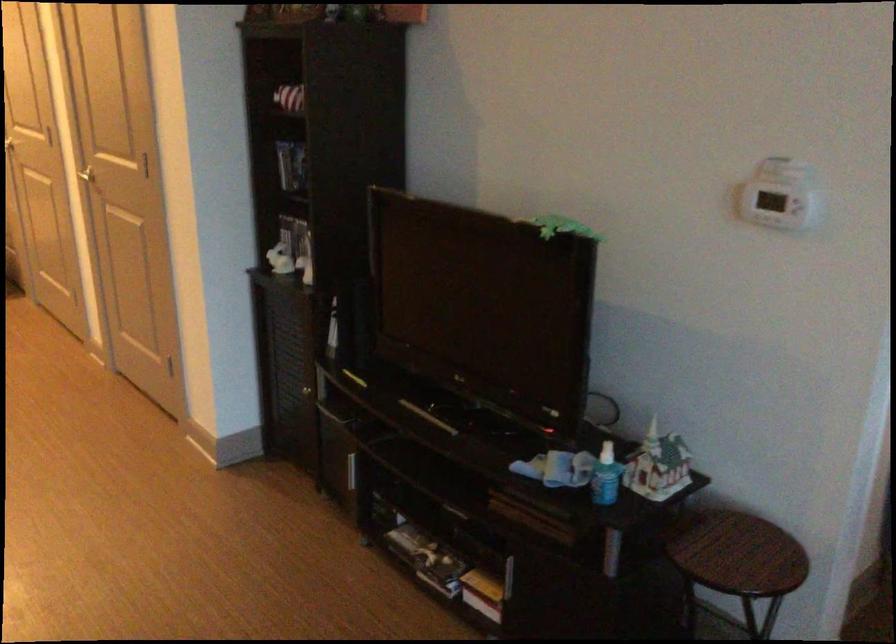
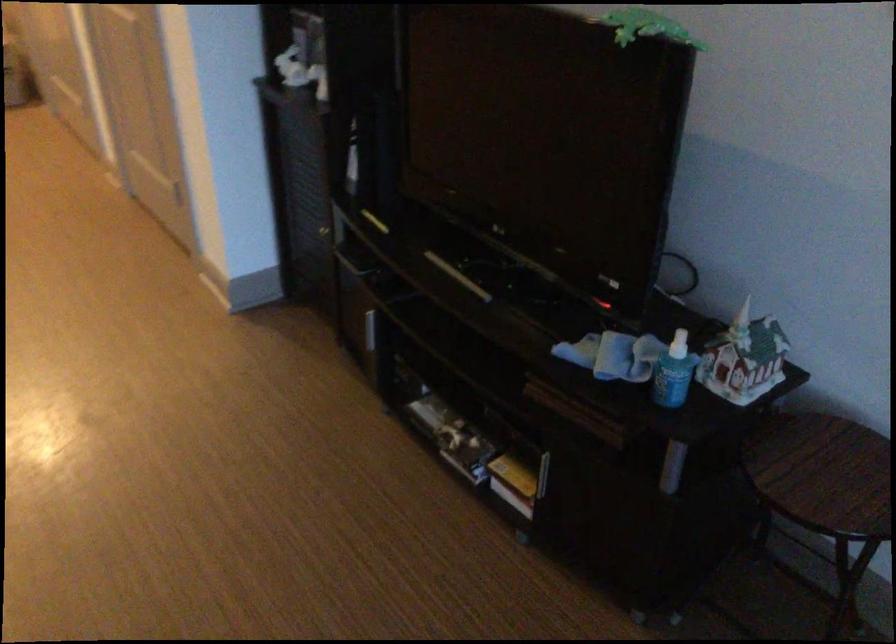
Question: The images are taken continuously from a first-person perspective. In which direction are you moving?

Choices:
 (A) Left
 (B) Right
 (C) Forward
 (D) Backward

Answer: (C)